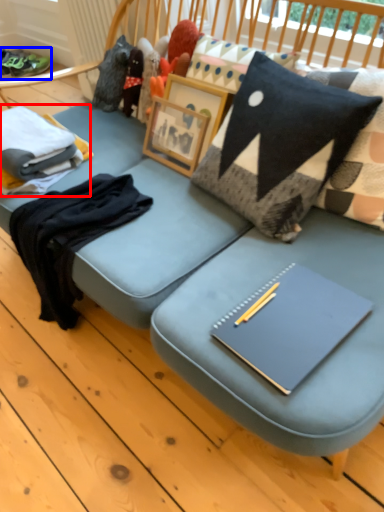
Question: Which object is further to the camera taking this photo, clothing (highlighted by a red box) or footwear (highlighted by a blue box)?

Choices:
 (A) clothing
 (B) footwear

Answer: (B)